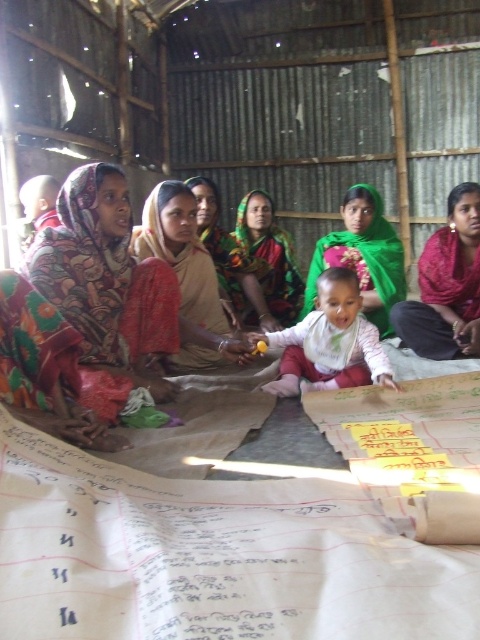
You are a photographer standing in front of the women in the scene. You want to take a photo that includes both the red fabric headscarf at center and the green fabric headscarf at center. If your camera has a maximum focus range of 1 meter, will you be able to capture both in focus at the same time?

The red fabric headscarf at center and green fabric headscarf at center are 1.06 meters apart from each other. Since the distance between them exceeds the camera maximum focus range of 1 meter, you won not be able to capture both in focus simultaneously.

You are a tailor who needs to choose between two headscarves for a client. The client prefers a wider scarf. Which one should you pick between the printed fabric headscarf at center and the red fabric headscarf at center?

The printed fabric headscarf at center is wider than the red fabric headscarf at center, so you should choose the printed fabric headscarf at center for the client.

Looking at this image, you are standing in the room where the women are having their meeting. There are two points marked in the scene, one at coordinates point (131,356) and another at point (372,195). Which point is closer to you?

Point (131,356) is closer to the viewer than point (372,195).